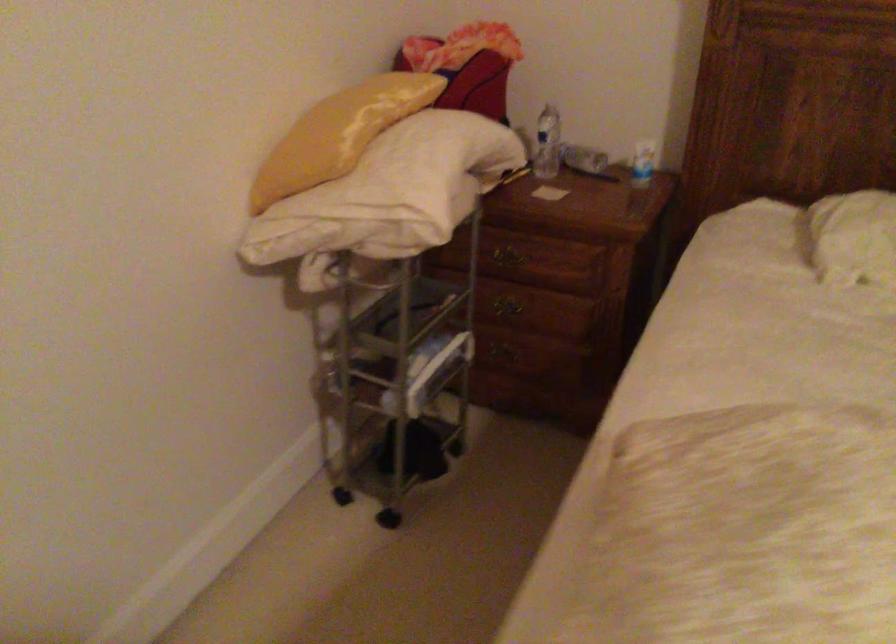
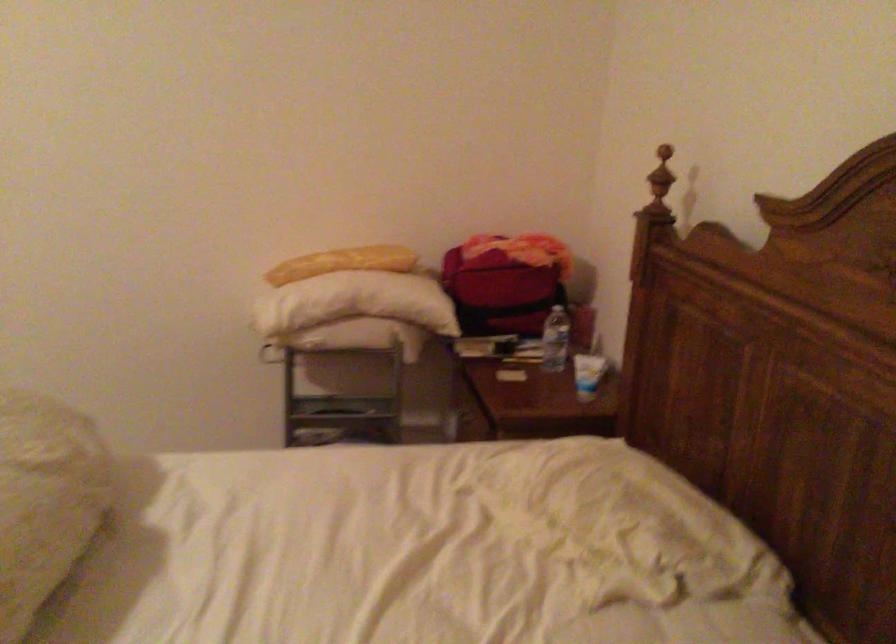
Find the pixel in the second image that matches the point at 375,120 in the first image.

(342, 263)